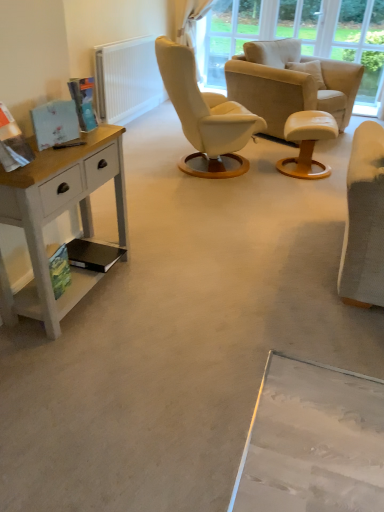
Question: From a real-world perspective, relative to transparent glass window screen at upper center, is white textured radiator at upper left vertically above or below?

Choices:
 (A) above
 (B) below

Answer: (B)

Question: Considering the positions of white textured radiator at upper left and transparent glass window screen at upper center in the image, is white textured radiator at upper left taller or shorter than transparent glass window screen at upper center?

Choices:
 (A) tall
 (B) short

Answer: (B)

Question: Which is nearer to the white textured radiator at upper left?

Choices:
 (A) white leather stool at center
 (B) white painted wood desk at left
 (C) beige fabric armchair at center
 (D) transparent glass window screen at upper center

Answer: (D)

Question: Estimate the real-world distances between objects in this image. Which object is closer to the white painted wood desk at left?

Choices:
 (A) beige fabric armchair at center
 (B) white textured radiator at upper left
 (C) transparent glass window screen at upper center
 (D) white leather stool at center

Answer: (D)